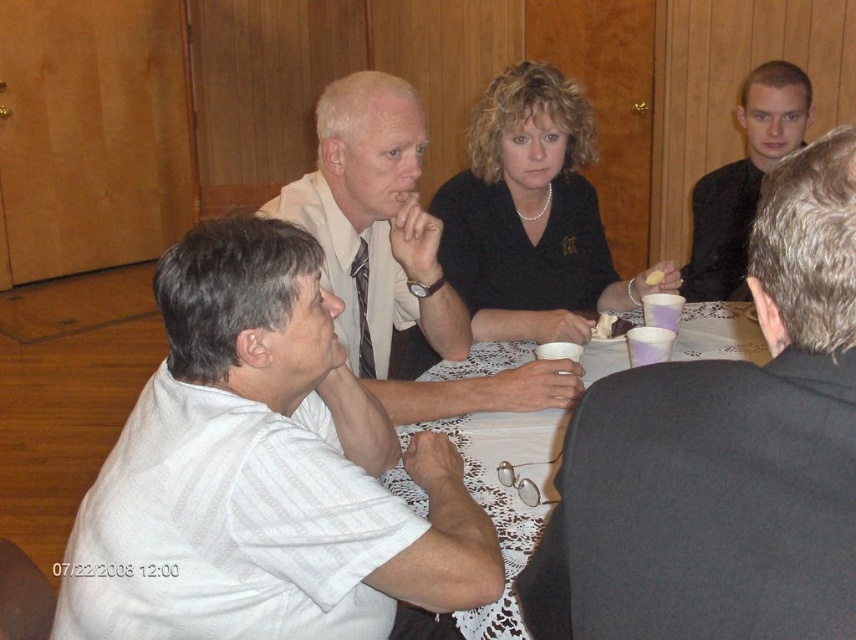
You are a photographer taking a picture of the scene. You notice the white lace tablecloth at center and the black smooth shirt at upper right. Which object is closer to the camera?

The black smooth shirt at upper right is closer to the camera because it is positioned over the white lace tablecloth at center.

You are planning to place a decorative centerpiece on the white lace tablecloth at center. Considering the size of the black smooth shirt at upper right, will the tablecloth be wide enough to accommodate the centerpiece without it overlapping the shirt?

The white lace tablecloth at center is wider than the black smooth shirt at upper right, so the tablecloth should be wide enough to place the centerpiece without overlapping the shirt.